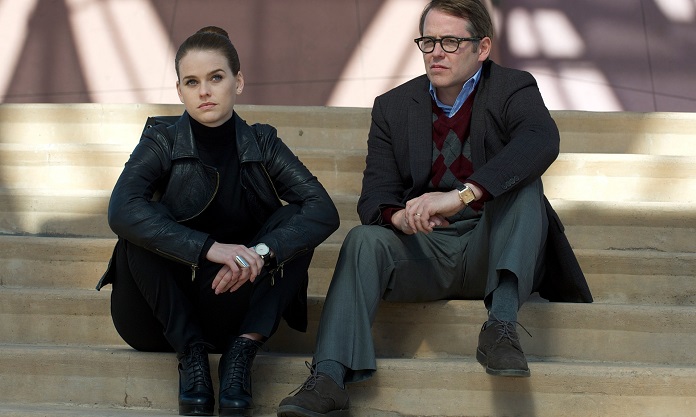
This screenshot has width=696, height=417. Identify the location of sock. (505, 296), (335, 368).